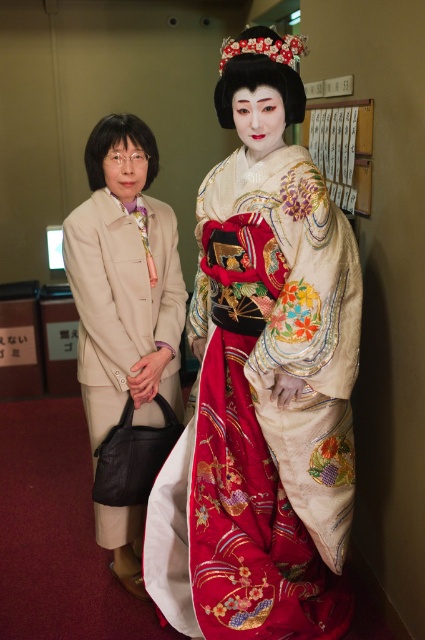
Is point (215, 99) positioned before point (107, 220)?

Yes, point (215, 99) is in front of point (107, 220).

Identify the location of silky white kimono at center. This screenshot has height=640, width=425. (263, 381).

Identify the location of silky white kimono at center. The width and height of the screenshot is (425, 640). (263, 381).